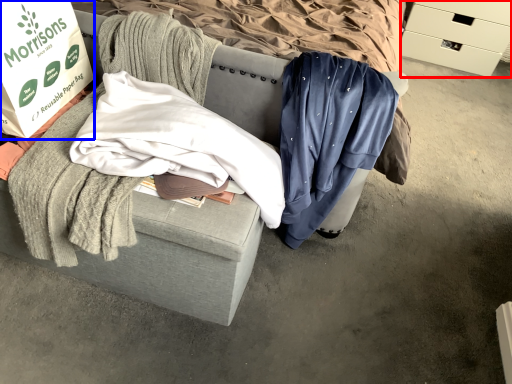
Question: Which of the following is the farthest to the observer, drawer (highlighted by a red box) or box (highlighted by a blue box)?

Choices:
 (A) drawer
 (B) box

Answer: (A)